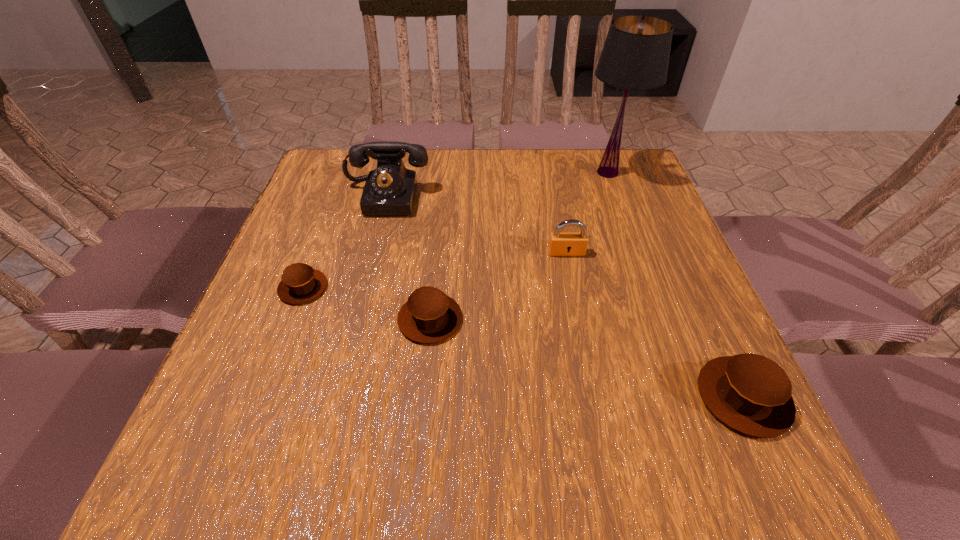
Find the location of a particular element. the shortest object is located at coordinates (300, 283).

The height and width of the screenshot is (540, 960). I want to click on the leftmost muffin, so click(x=300, y=283).

You are a GUI agent. You are given a task and a screenshot of the screen. Output one action in this format:
    pyautogui.click(x=<x>, y=<y>)
    Task: Click on the second muffin from right to left
    The height and width of the screenshot is (540, 960).
    Given the screenshot: What is the action you would take?
    pyautogui.click(x=429, y=316)

Locate an element on the screen. The image size is (960, 540). the second shortest muffin is located at coordinates (429, 316).

This screenshot has height=540, width=960. I want to click on the tallest muffin, so click(750, 393).

Locate an element on the screen. the rightmost muffin is located at coordinates (750, 393).

What are the coordinates of `lampshade` in the screenshot? It's located at coord(635,56).

Image resolution: width=960 pixels, height=540 pixels. I want to click on the second tallest object, so click(x=390, y=189).

Where is `the fourth object from left to right`? The image size is (960, 540). the fourth object from left to right is located at coordinates (560, 243).

In order to click on padlock in this screenshot , I will do `click(560, 243)`.